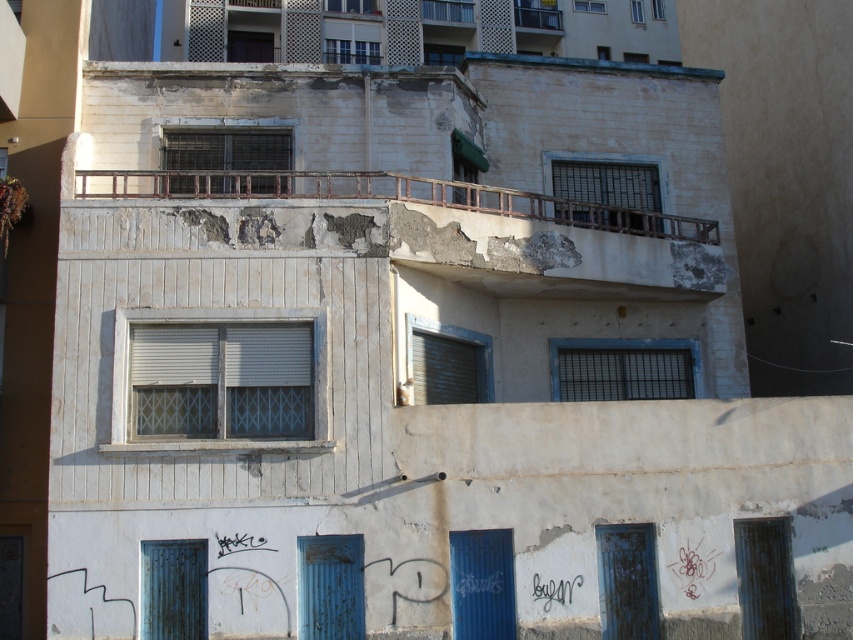
You are a painter who needs to choose between two shutters to paint. The white matte shutter at center and the blue painted wood shutter at lower right. Which shutter has a greater width?

The white matte shutter at center has a greater width than the blue painted wood shutter at lower right.

You are a delivery person trying to find the correct entrance to a building. You see two shutters, the white matte shutter at center and the blue painted wood shutter at lower right. Which shutter should you approach if you need to go to the left side of the building?

The white matte shutter at center is to the left of the blue painted wood shutter at lower right, so to reach the left side of the building, you should approach the white matte shutter at center.